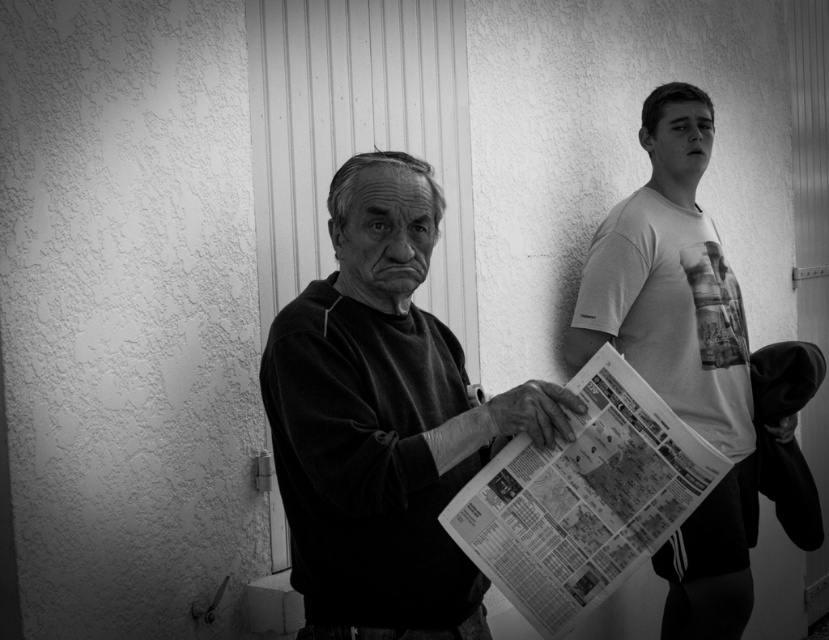
Does point (384, 305) come behind point (660, 500)?

Yes, it is behind point (660, 500).

How much distance is there between matte black sweater at center and printed newspaper at center?

matte black sweater at center is 6.93 inches away from printed newspaper at center.

Does point (383, 438) lie in front of point (545, 548)?

Yes, it is.

Locate an element on the screen. The height and width of the screenshot is (640, 829). matte black sweater at center is located at coordinates (383, 420).

The width and height of the screenshot is (829, 640). What do you see at coordinates (681, 353) in the screenshot? I see `white printed t-shirt at right` at bounding box center [681, 353].

Can you confirm if white printed t-shirt at right is positioned above printed newspaper at center?

Yes.

Identify the location of white printed t-shirt at right. The height and width of the screenshot is (640, 829). (681, 353).

In the scene shown: Which of these two, matte black sweater at center or white printed t-shirt at right, stands shorter?

matte black sweater at center is shorter.

Does matte black sweater at center have a lesser width compared to white printed t-shirt at right?

Yes.

At what (x,y) coordinates should I click in order to perform the action: click on matte black sweater at center. Please return your answer as a coordinate pair (x, y). The image size is (829, 640). Looking at the image, I should click on (383, 420).

You are a GUI agent. You are given a task and a screenshot of the screen. Output one action in this format:
    pyautogui.click(x=<x>, y=<y>)
    Task: Click on the matte black sweater at center
    Image resolution: width=829 pixels, height=640 pixels.
    Given the screenshot: What is the action you would take?
    pyautogui.click(x=383, y=420)